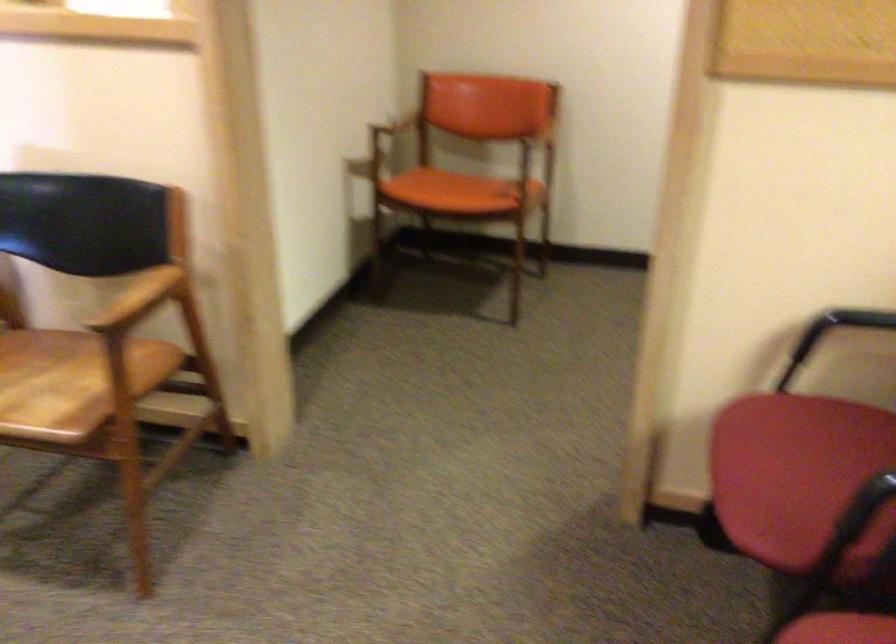
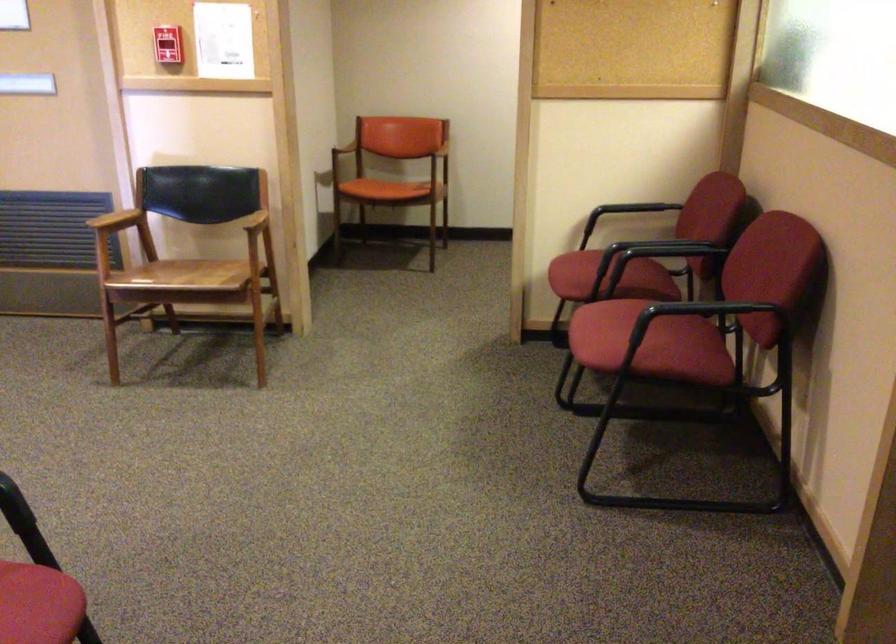
Find the pixel in the second image that matches the point at 455,192 in the first image.

(392, 183)